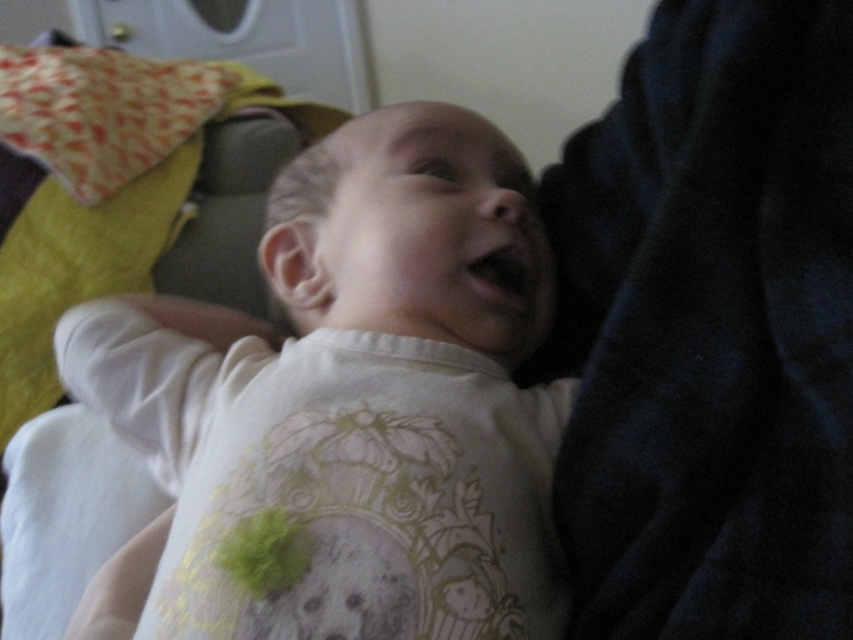
Question: Which point is closer to the camera?

Choices:
 (A) (312, 461)
 (B) (44, 164)

Answer: (A)

Question: Can you confirm if white soft baby at center is positioned below printed fabric pillow at upper left?

Choices:
 (A) yes
 (B) no

Answer: (A)

Question: Is white soft baby at center further to the viewer compared to printed fabric pillow at upper left?

Choices:
 (A) yes
 (B) no

Answer: (B)

Question: Considering the relative positions of white soft baby at center and printed fabric pillow at upper left in the image provided, where is white soft baby at center located with respect to printed fabric pillow at upper left?

Choices:
 (A) right
 (B) left

Answer: (A)